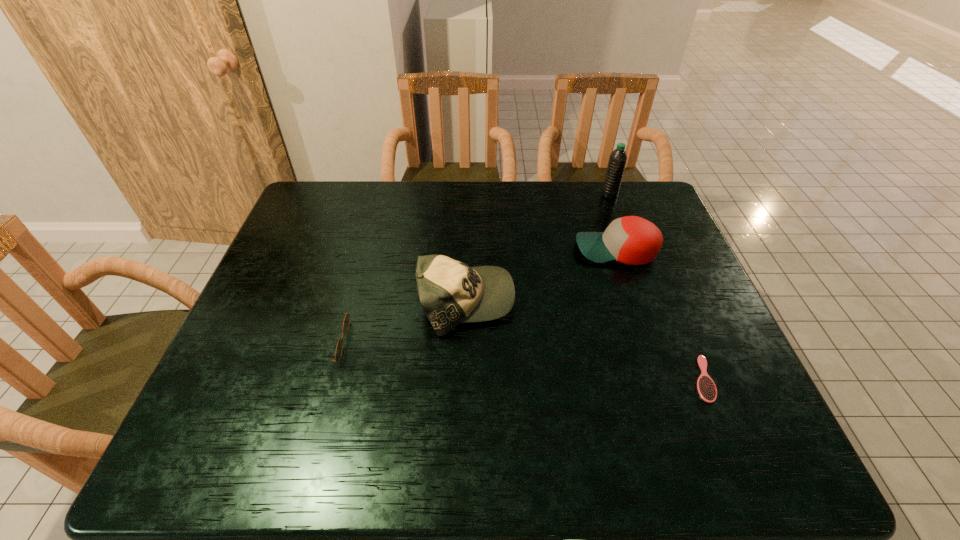
Identify which object is the closest to the hairbrush. Please provide its 2D coordinates. Your answer should be formatted as a tuple, i.e. [(x, y)], where the tuple contains the x and y coordinates of a point satisfying the conditions above.

[(633, 240)]

I want to click on vacant space that satisfies the following two spatial constraints: 1. on the back side of the hairbrush; 2. at the brim of the second farthest object, so click(650, 250).

This screenshot has width=960, height=540. In order to click on vacant space that satisfies the following two spatial constraints: 1. on the back side of the shortest object; 2. at the brim of the right baseball cap in this screenshot , I will do `click(650, 250)`.

I want to click on vacant position in the image that satisfies the following two spatial constraints: 1. on the face of the hairbrush; 2. on the left side of the leftmost object, so click(x=312, y=379).

Identify the location of free space that satisfies the following two spatial constraints: 1. at the brim of the hairbrush; 2. on the left side of the second farthest object. The width and height of the screenshot is (960, 540). (659, 379).

You are a GUI agent. You are given a task and a screenshot of the screen. Output one action in this format:
    pyautogui.click(x=<x>, y=<y>)
    Task: Click on the free region that satisfies the following two spatial constraints: 1. on the face of the hairbrush; 2. on the left side of the leftmost object
    Image resolution: width=960 pixels, height=540 pixels.
    Given the screenshot: What is the action you would take?
    pyautogui.click(x=312, y=379)

This screenshot has height=540, width=960. Find the location of `vacant area that satisfies the following two spatial constraints: 1. on the front side of the tallest object; 2. on the left side of the hairbrush`. vacant area that satisfies the following two spatial constraints: 1. on the front side of the tallest object; 2. on the left side of the hairbrush is located at coordinates (675, 379).

Where is `free space that satisfies the following two spatial constraints: 1. at the brim of the hairbrush; 2. on the right side of the right baseball cap`? free space that satisfies the following two spatial constraints: 1. at the brim of the hairbrush; 2. on the right side of the right baseball cap is located at coordinates (659, 379).

This screenshot has width=960, height=540. I want to click on vacant position in the image that satisfies the following two spatial constraints: 1. on the front side of the water bottle; 2. on the front-facing side of the left baseball cap, so click(648, 301).